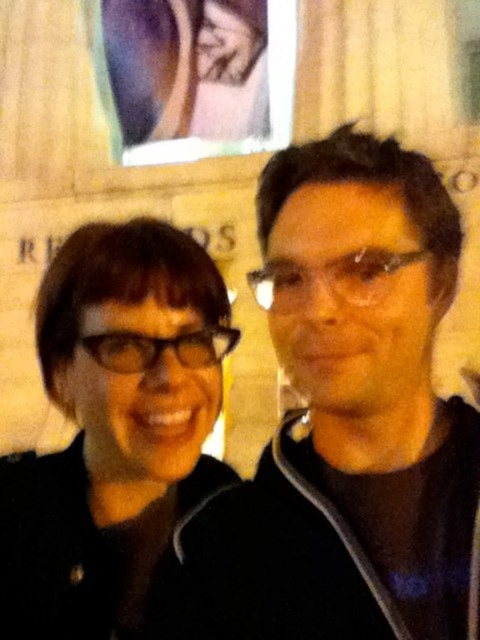
Question: Considering the real-world distances, which object is closest to the black plastic glasses at center?

Choices:
 (A) matte black glasses at center
 (B) black matte glasses at left

Answer: (B)

Question: Does black matte glasses at left have a larger size compared to matte black glasses at center?

Choices:
 (A) no
 (B) yes

Answer: (B)

Question: Is matte black glasses at center below black plastic glasses at center?

Choices:
 (A) no
 (B) yes

Answer: (A)

Question: Is black matte glasses at left smaller than black plastic glasses at center?

Choices:
 (A) yes
 (B) no

Answer: (B)

Question: Estimate the real-world distances between objects in this image. Which object is farther from the matte black glasses at center?

Choices:
 (A) black plastic glasses at center
 (B) black matte glasses at left

Answer: (B)

Question: Which point is closer to the camera taking this photo?

Choices:
 (A) (409, 257)
 (B) (179, 342)
 (C) (120, 225)

Answer: (A)